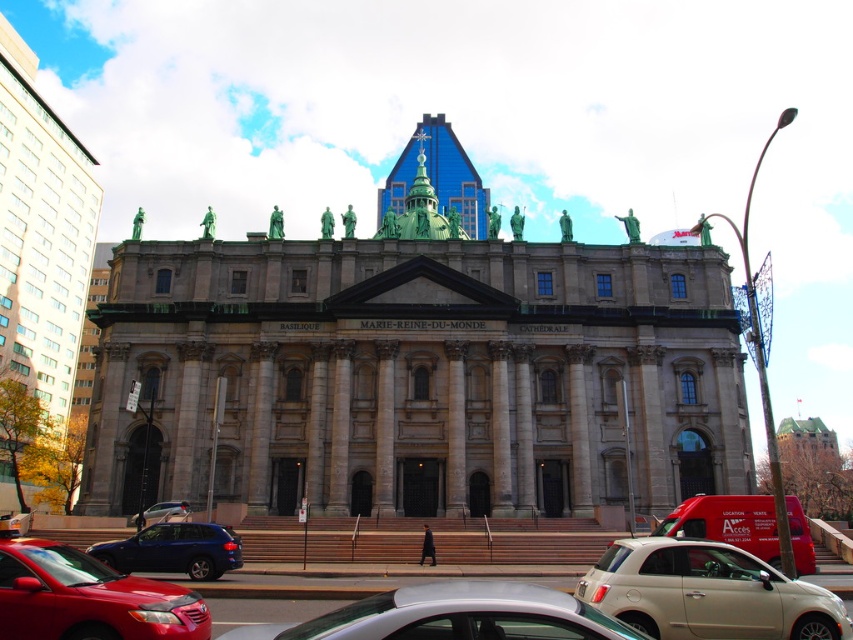
Between shiny blue suv at lower left and matte silver car at center, which one is positioned higher?

matte silver car at center is above.

Can you confirm if shiny blue suv at lower left is thinner than matte silver car at center?

No.

What do you see at coordinates (173, 550) in the screenshot? Image resolution: width=853 pixels, height=640 pixels. I see `shiny blue suv at lower left` at bounding box center [173, 550].

Identify the location of shiny blue suv at lower left. The image size is (853, 640). (173, 550).

Does beige matte car at lower center come in front of matte silver car at center?

Yes, beige matte car at lower center is closer to the viewer.

Describe the element at coordinates (706, 593) in the screenshot. I see `beige matte car at lower center` at that location.

Between point (761, 637) and point (155, 508), which one is positioned behind?

Point (155, 508)

You are a GUI agent. You are given a task and a screenshot of the screen. Output one action in this format:
    pyautogui.click(x=<x>, y=<y>)
    Task: Click on the beige matte car at lower center
    This screenshot has height=640, width=853.
    Given the screenshot: What is the action you would take?
    pyautogui.click(x=706, y=593)

Can you confirm if beige matte car at lower center is bigger than silver metallic sedan at lower center?

A: Incorrect, beige matte car at lower center is not larger than silver metallic sedan at lower center.

Is beige matte car at lower center to the right of silver metallic sedan at lower center from the viewer's perspective?

Indeed, beige matte car at lower center is positioned on the right side of silver metallic sedan at lower center.

Between point (779, 624) and point (511, 595), which one is positioned behind?

The point (779, 624) is behind.

At what (x,y) coordinates should I click in order to perform the action: click on beige matte car at lower center. Please return your answer as a coordinate pair (x, y). Looking at the image, I should click on (706, 593).